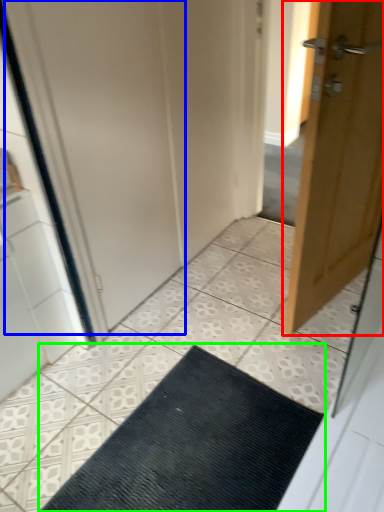
Question: Which object is positioned closest to door (highlighted by a red box)? Select from screen door (highlighted by a blue box) and doormat (highlighted by a green box).

Choices:
 (A) screen door
 (B) doormat

Answer: (A)